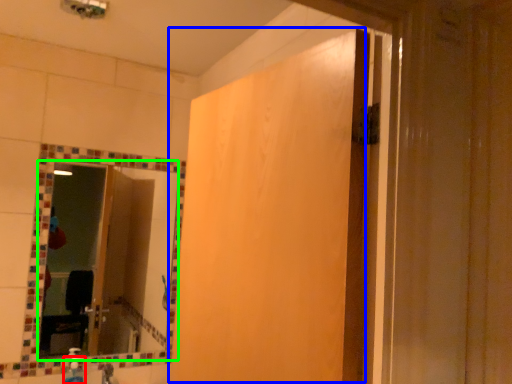
Question: Estimate the real-world distances between objects in this image. Which object is closer to soap dispenser (highlighted by a red box), screen door (highlighted by a blue box) or mirror (highlighted by a green box)?

Choices:
 (A) screen door
 (B) mirror

Answer: (B)